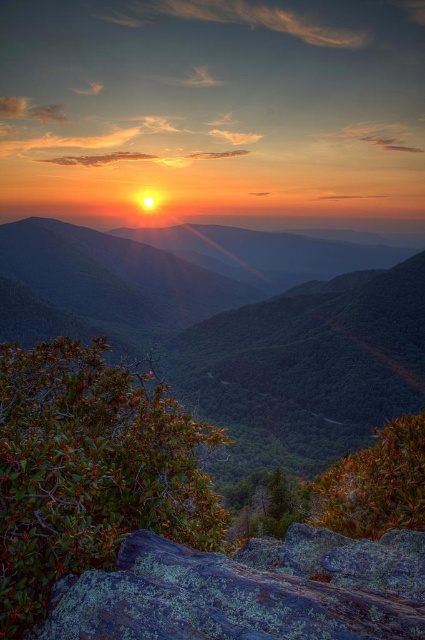
From the picture: You are a hiker planning to take a photo of the sunset. You have a camera with a standard lens that can capture a wide view. Which object, the green leafy mountain at center or the green mossy rock at lower center, should you focus on to ensure it takes up most of the frame?

The green leafy mountain at center has a larger size compared to the green mossy rock at lower center, so focusing on it will ensure it takes up most of the frame.

You are standing at the base of the green mossy rock at lower center and want to walk towards the green leafy mountain at center. Which direction should you head?

The green leafy mountain at center is positioned on the left side of green mossy rock at lower center, so you should head to the left to reach it.

You are standing in the mountain landscape and want to reach the green leafy mountain at center. Which direction should you move relative to the green mossy rock at lower center?

You should move away from the green mossy rock at lower center because the green leafy mountain at center is further away from you.